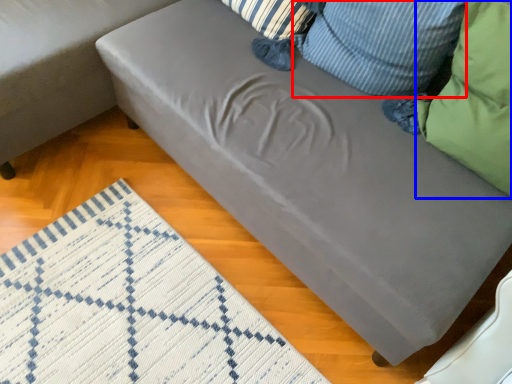
Question: Which object appears farthest to the camera in this image, pillow (highlighted by a red box) or pillow (highlighted by a blue box)?

Choices:
 (A) pillow
 (B) pillow

Answer: (A)